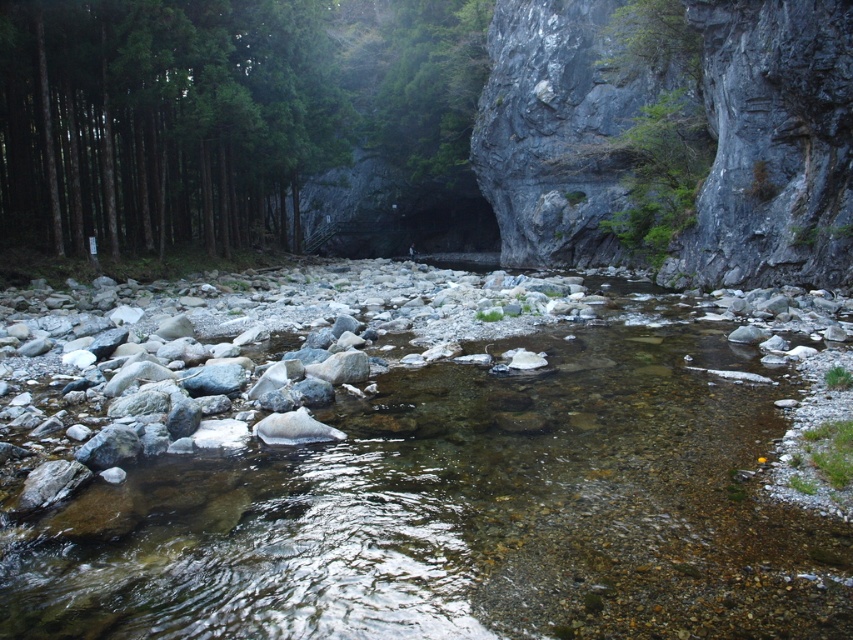
You are standing at the edge of the river and want to cross to the other side. The clear water at center is where the river is deepest. Which direction should you walk to find the shallowest part of the river?

Since the clear water at center is located at point (463, 513), which is towards the center of the river, you should walk towards the edges of the river away from the clear water at center to find the shallowest parts.

You are a hiker trying to cross the river. You see the clear water at center and the green matte tree at left. Which object is closer to the ground?

The clear water at center is below green matte tree at left, so the clear water at center is closer to the ground.

You are planning to cross the river and need to know which area is wider between the clear water at center and the green matte tree at left. Which one is wider?

The clear water at center occupies less space than the green matte tree at left, so the green matte tree at left is wider.